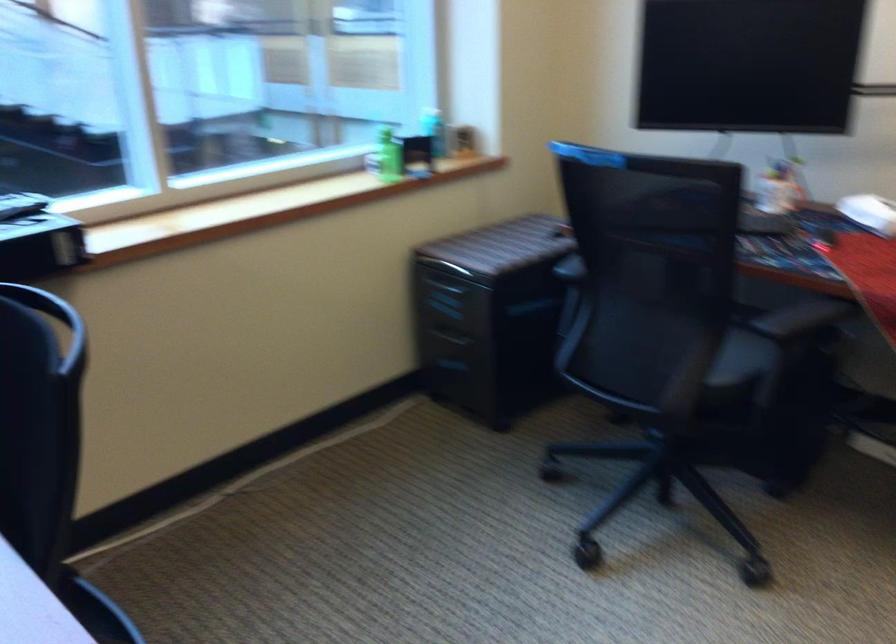
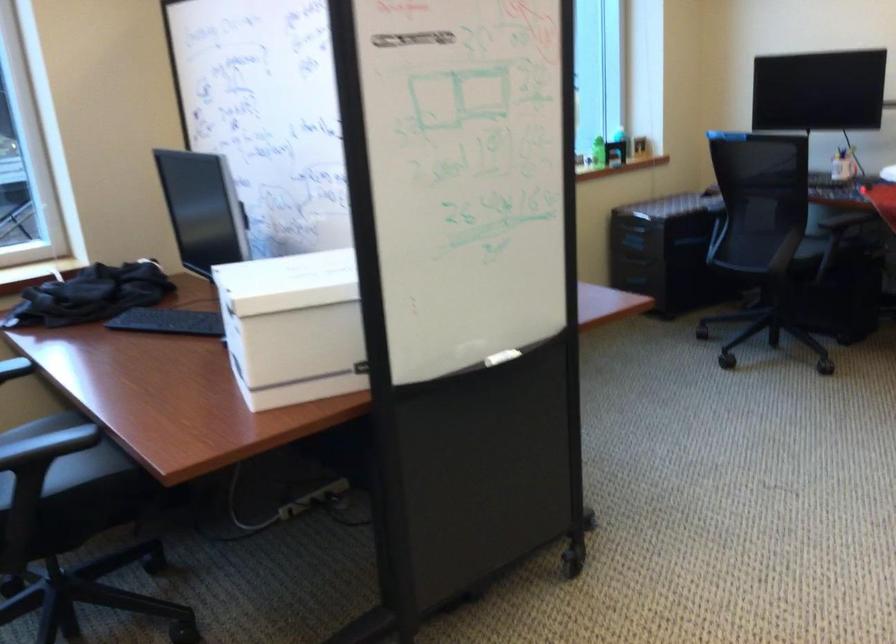
The point at (719,379) is marked in the first image. Where is the corresponding point in the second image?

(811, 248)